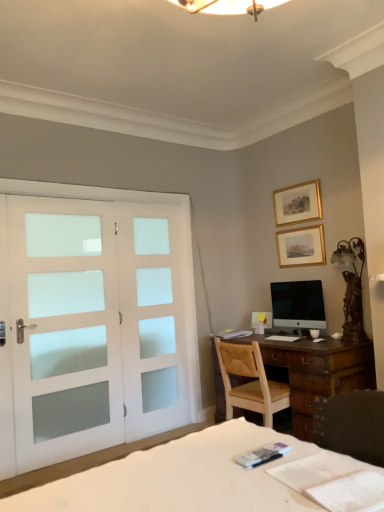
The height and width of the screenshot is (512, 384). Describe the element at coordinates (152, 319) in the screenshot. I see `white frosted glass screen door at left` at that location.

Where is `bronze/metallic table lamp at right`? This screenshot has height=512, width=384. bronze/metallic table lamp at right is located at coordinates (351, 288).

The height and width of the screenshot is (512, 384). Describe the element at coordinates (301, 247) in the screenshot. I see `gold-framed picture at upper right, which is the 1th picture frame in bottom-to-top order` at that location.

This screenshot has width=384, height=512. I want to click on light brown wooden chair at center, so click(x=249, y=381).

What do you see at coordinates (298, 305) in the screenshot? Image resolution: width=384 pixels, height=512 pixels. I see `black glossy monitor at center` at bounding box center [298, 305].

What do you see at coordinates (184, 477) in the screenshot?
I see `white fabric bed at lower left` at bounding box center [184, 477].

Measure the distance between gold/gilded picture frame at upper center, which is the 2th picture frame in bottom-to-top order, and camera.

A distance of 3.46 meters exists between gold/gilded picture frame at upper center, which is the 2th picture frame in bottom-to-top order, and camera.

In order to click on white frosted glass screen door at left in this screenshot , I will do `click(152, 319)`.

How distant is light brown wooden chair at center from white frosted glass doors at left?

light brown wooden chair at center is 3.47 feet away from white frosted glass doors at left.

Between point (274, 399) and point (128, 216), which one is positioned behind?

The point (128, 216) is more distant.

Identify the location of chair that appears below the white frosted glass doors at left (from a real-world perspective). (249, 381).

Considering the relative sizes of light brown wooden chair at center and white frosted glass doors at left in the image provided, is light brown wooden chair at center taller than white frosted glass doors at left?

Incorrect, the height of light brown wooden chair at center is not larger of that of white frosted glass doors at left.

Is gold-framed picture at upper right, which appears as the 2th picture frame when viewed from the top, oriented towards white frosted glass screen door at left?

No, gold-framed picture at upper right, which appears as the 2th picture frame when viewed from the top, is not facing towards white frosted glass screen door at left.

Is gold-framed picture at upper right, which appears as the 2th picture frame when viewed from the top, to the left of white frosted glass screen door at left from the viewer's perspective?

No.

In the image, there is a gold-framed picture at upper right, which is the 1th picture frame in bottom-to-top order. Find the location of `screen door below it (from the image's perspective)`. screen door below it (from the image's perspective) is located at coordinates (152, 319).

Is gold-framed picture at upper right, which appears as the 2th picture frame when viewed from the top, thinner than white frosted glass screen door at left?

Correct, the width of gold-framed picture at upper right, which appears as the 2th picture frame when viewed from the top, is less than that of white frosted glass screen door at left.

From the image's perspective, would you say white frosted glass doors at left is shown under black glossy monitor at center?

Indeed, from the image's perspective, white frosted glass doors at left is shown beneath black glossy monitor at center.

Considering the sizes of objects white frosted glass doors at left and black glossy monitor at center in the image provided, who is wider, white frosted glass doors at left or black glossy monitor at center?

white frosted glass doors at left is wider.

Does point (110, 230) come behind point (316, 310)?

Yes, point (110, 230) is behind point (316, 310).

Is white fabric bed at lower left touching bronze/metallic table lamp at right?

No, white fabric bed at lower left is not in contact with bronze/metallic table lamp at right.

Is point (47, 497) closer or farther from the camera than point (356, 296)?

Point (47, 497) is closer to the camera than point (356, 296).

Identify the location of table lamp that appears on the right of white fabric bed at lower left. This screenshot has width=384, height=512. (351, 288).

Is white frosted glass screen door at left aimed at white frosted glass doors at left?

No, white frosted glass screen door at left is not turned towards white frosted glass doors at left.

Is white frosted glass screen door at left smaller than white frosted glass doors at left?

Yes, white frosted glass screen door at left is smaller than white frosted glass doors at left.

From a real-world perspective, is white frosted glass screen door at left physically located above or below white frosted glass doors at left?

In terms of real-world spatial position, white frosted glass screen door at left is below white frosted glass doors at left.

Identify the location of door in front of the white frosted glass screen door at left. (97, 318).

From a real-world perspective, is bronze/metallic table lamp at right above or below gold-framed picture at upper right, which appears as the 2th picture frame when viewed from the top?

bronze/metallic table lamp at right is below gold-framed picture at upper right, which appears as the 2th picture frame when viewed from the top.

Who is smaller, bronze/metallic table lamp at right or gold-framed picture at upper right, which appears as the 2th picture frame when viewed from the top?

Smaller between the two is gold-framed picture at upper right, which appears as the 2th picture frame when viewed from the top.

From the image's perspective, is bronze/metallic table lamp at right above or below gold-framed picture at upper right, which is the 1th picture frame in bottom-to-top order?

Clearly, from the image's perspective, bronze/metallic table lamp at right is below gold-framed picture at upper right, which is the 1th picture frame in bottom-to-top order.

Does bronze/metallic table lamp at right turn towards gold-framed picture at upper right, which is the 1th picture frame in bottom-to-top order?

No, bronze/metallic table lamp at right is not aimed at gold-framed picture at upper right, which is the 1th picture frame in bottom-to-top order.

The width and height of the screenshot is (384, 512). Find the location of `screen door in front of the gold/gilded picture frame at upper center, which is the 2th picture frame in bottom-to-top order`. screen door in front of the gold/gilded picture frame at upper center, which is the 2th picture frame in bottom-to-top order is located at coordinates (152, 319).

Consider the image. Considering the sizes of objects gold/gilded picture frame at upper center, positioned as the 1th picture frame in top-to-bottom order, and white frosted glass screen door at left in the image provided, who is thinner, gold/gilded picture frame at upper center, positioned as the 1th picture frame in top-to-bottom order, or white frosted glass screen door at left?

white frosted glass screen door at left is thinner.

From a real-world perspective, which is physically below, gold/gilded picture frame at upper center, which is the 2th picture frame in bottom-to-top order, or white frosted glass screen door at left?

white frosted glass screen door at left is physically lower.

Is white frosted glass screen door at left at the back of gold/gilded picture frame at upper center, which is the 2th picture frame in bottom-to-top order?

No, white frosted glass screen door at left is not at the back of gold/gilded picture frame at upper center, which is the 2th picture frame in bottom-to-top order.

At what (x,y) coordinates should I click in order to perform the action: click on door above the light brown wooden chair at center (from a real-world perspective). Please return your answer as a coordinate pair (x, y). The width and height of the screenshot is (384, 512). Looking at the image, I should click on (97, 318).

From the image's perspective, starting from the white frosted glass screen door at left, which picture frame is the 1st one above? Please provide its 2D coordinates.

[(301, 247)]

Estimate the real-world distances between objects in this image. Which object is further from gold-framed picture at upper right, which appears as the 2th picture frame when viewed from the top, white frosted glass doors at left or light brown wooden chair at center?

white frosted glass doors at left.

Estimate the real-world distances between objects in this image. Which object is closer to gold/gilded picture frame at upper center, which is the 2th picture frame in bottom-to-top order, white frosted glass doors at left or white fabric bed at lower left?

white frosted glass doors at left lies closer to gold/gilded picture frame at upper center, which is the 2th picture frame in bottom-to-top order, than the other object.

Considering their positions, is gold-framed picture at upper right, which is the 1th picture frame in bottom-to-top order, positioned further to black glossy monitor at center than white frosted glass doors at left?

white frosted glass doors at left is positioned further to the anchor black glossy monitor at center.

From the image, which object appears to be farther from gold/gilded picture frame at upper center, which is the 2th picture frame in bottom-to-top order, bronze/metallic table lamp at right or black glossy monitor at center?

Based on the image, black glossy monitor at center appears to be further to gold/gilded picture frame at upper center, which is the 2th picture frame in bottom-to-top order.

Which object lies further to the anchor point white fabric bed at lower left, white frosted glass screen door at left or black glossy monitor at center?

white frosted glass screen door at left is further to white fabric bed at lower left.

Which object lies further to the anchor point bronze/metallic table lamp at right, white frosted glass doors at left or white fabric bed at lower left?

white fabric bed at lower left.

Looking at the image, which one is located further to white frosted glass doors at left, gold-framed picture at upper right, which appears as the 2th picture frame when viewed from the top, or bronze/metallic table lamp at right?

Among the two, bronze/metallic table lamp at right is located further to white frosted glass doors at left.

Looking at the image, which one is located further to white fabric bed at lower left, bronze/metallic table lamp at right or white frosted glass screen door at left?

white frosted glass screen door at left is positioned further to the anchor white fabric bed at lower left.

The height and width of the screenshot is (512, 384). I want to click on computer monitor between gold/gilded picture frame at upper center, positioned as the 1th picture frame in top-to-bottom order, and light brown wooden chair at center, in the vertical direction, so click(298, 305).

Find the location of a particular element. computer monitor between white fabric bed at lower left and gold/gilded picture frame at upper center, which is the 2th picture frame in bottom-to-top order, in the front-back direction is located at coordinates (298, 305).

You are a GUI agent. You are given a task and a screenshot of the screen. Output one action in this format:
    pyautogui.click(x=<x>, y=<y>)
    Task: Click on the chair between white frosted glass screen door at left and bronze/metallic table lamp at right from left to right
    The height and width of the screenshot is (512, 384).
    Given the screenshot: What is the action you would take?
    pyautogui.click(x=249, y=381)

Locate an element on the screen. The image size is (384, 512). computer monitor between white fabric bed at lower left and gold-framed picture at upper right, which is the 1th picture frame in bottom-to-top order, from front to back is located at coordinates (298, 305).